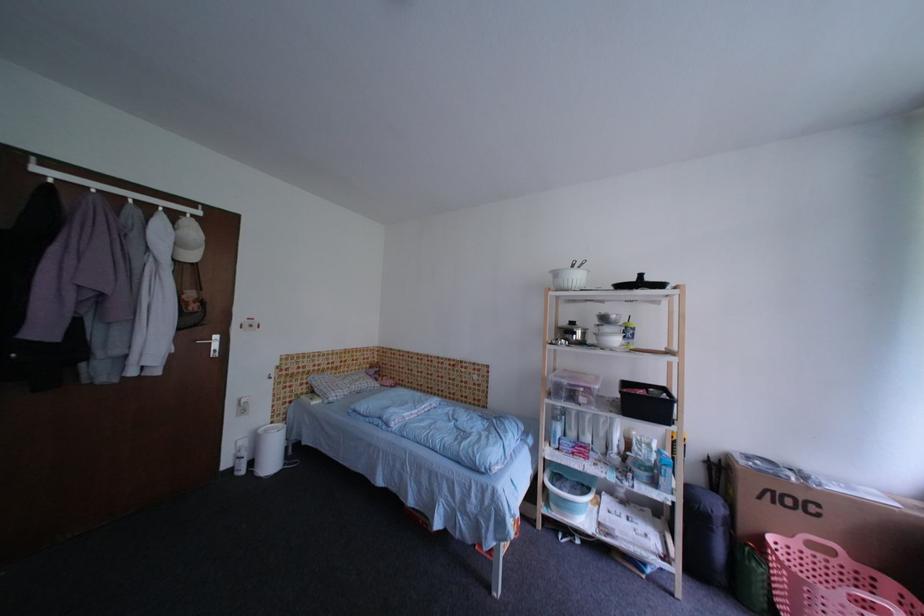
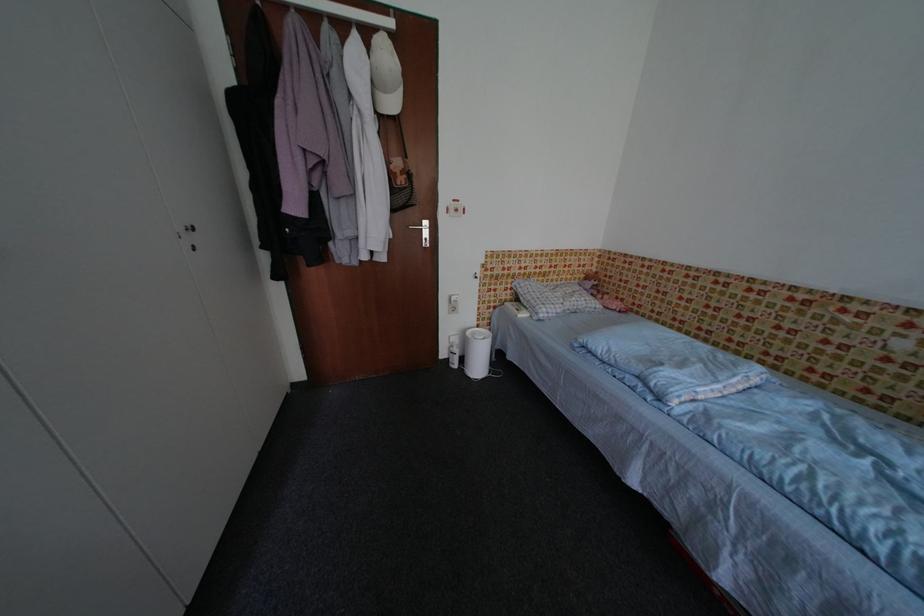
The point at (201,259) is marked in the first image. Where is the corresponding point in the second image?

(400, 107)